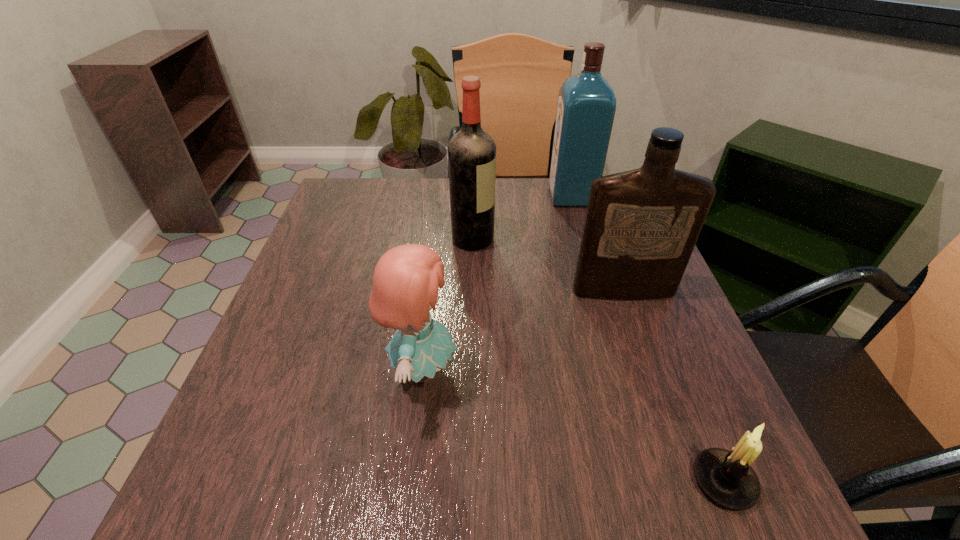
In order to click on free space at the left edge of the desktop in this screenshot , I will do `click(369, 241)`.

Locate an element on the screen. The width and height of the screenshot is (960, 540). free space at the right edge of the desktop is located at coordinates (685, 320).

I want to click on vacant area that lies between the second farthest liquor and the nearest liquor, so click(x=548, y=265).

At what (x,y) coordinates should I click in order to perform the action: click on free space between the nearest liquor and the nearest object. Please return your answer as a coordinate pair (x, y). The image size is (960, 540). Looking at the image, I should click on (674, 386).

I want to click on free space that is in between the leftmost liquor and the fourth farthest object, so click(x=447, y=304).

The width and height of the screenshot is (960, 540). What are the coordinates of `vacant space that is in between the nearest object and the farthest object` in the screenshot? It's located at (648, 339).

Locate an element on the screen. The height and width of the screenshot is (540, 960). free space that is in between the leftmost liquor and the third farthest object is located at coordinates (548, 265).

This screenshot has height=540, width=960. I want to click on free point between the second shortest object and the leftmost liquor, so click(x=447, y=304).

What are the coordinates of `free space that is in between the farthest object and the shortest object` in the screenshot? It's located at (648, 339).

Identify the location of blank region between the farthest liquor and the nearest object. (648, 339).